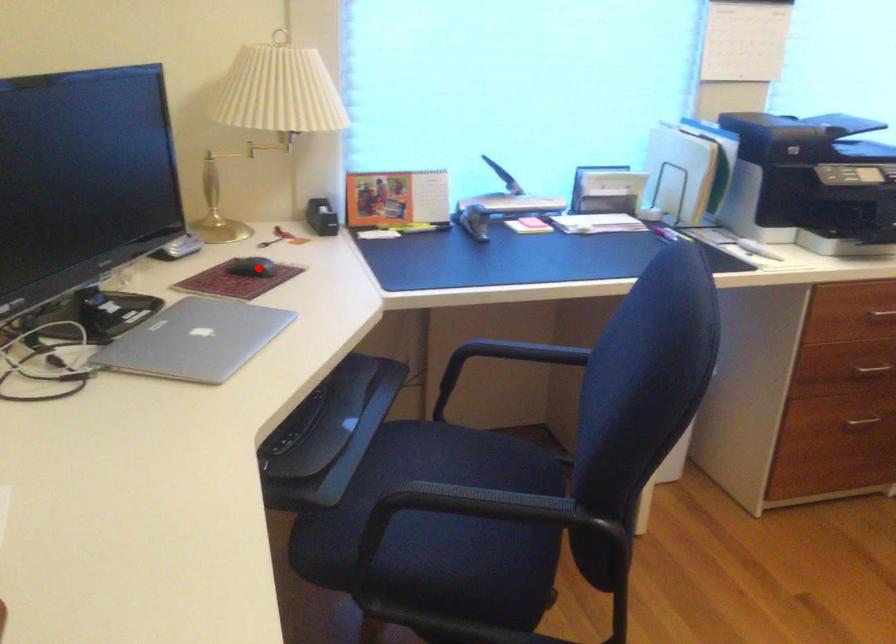
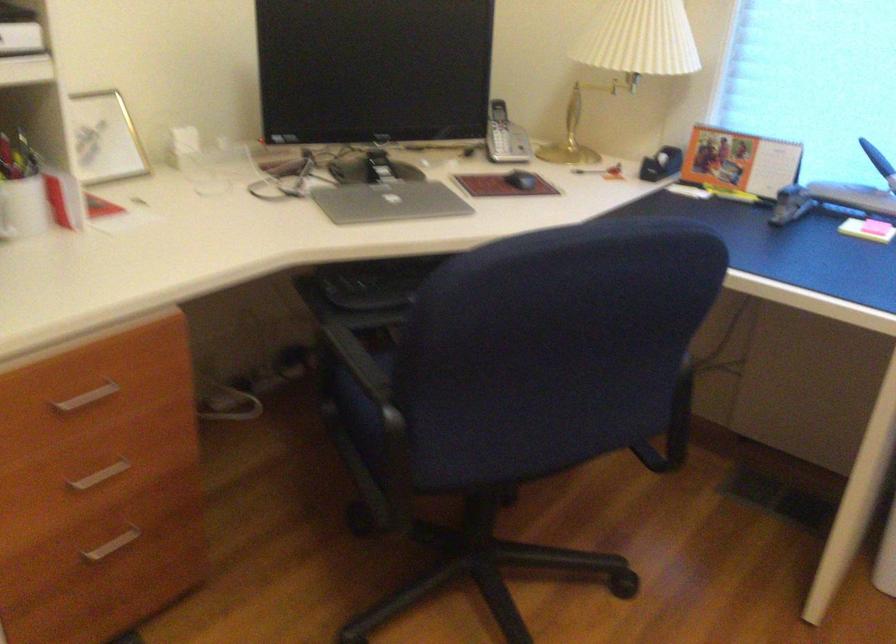
Where in the second image is the point corresponding to the highlighted location from the first image?

(521, 180)